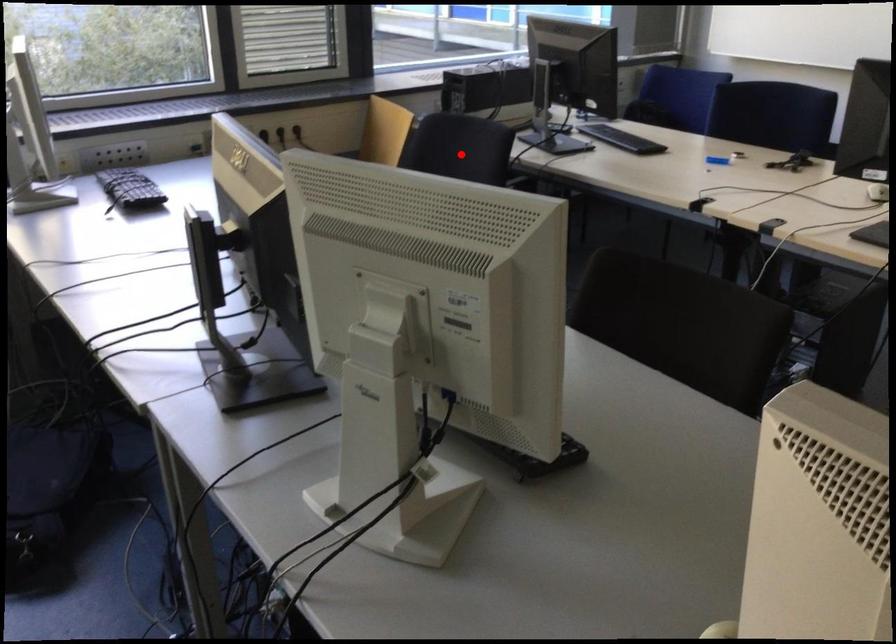
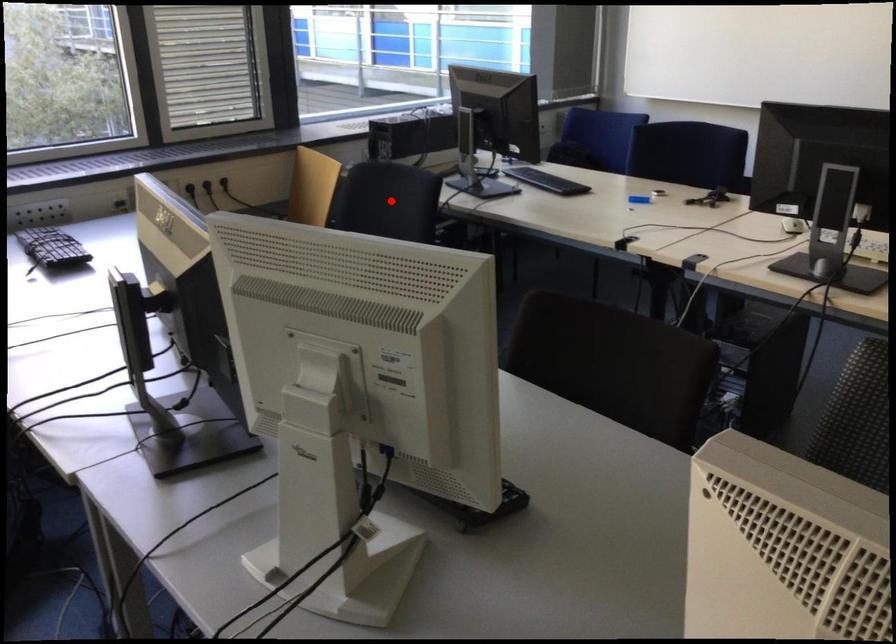
I am providing you with two images of the same scene from different viewpoints. A red point is marked on the first image and another point is marked on the second image. Do the highlighted points in image1 and image2 indicate the same real-world spot?

Yes